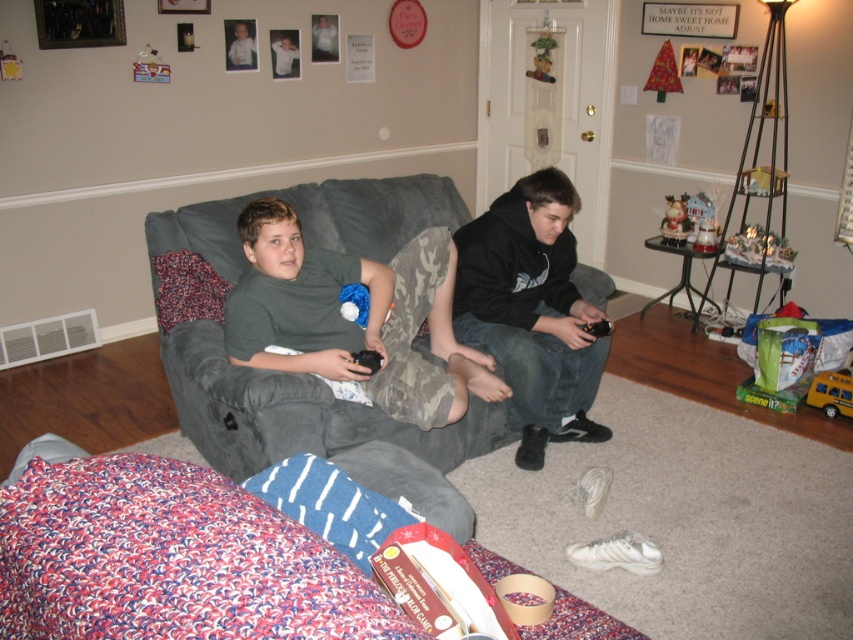
Does point (463, 396) come farther from viewer compared to point (494, 204)?

That is False.

Which is behind, point (273, 268) or point (489, 244)?

Point (489, 244)

Measure the distance between point (422, 307) and camera.

Point (422, 307) is 9.12 feet away from camera.

The image size is (853, 640). I want to click on green cotton shirt at center, so click(352, 321).

Measure the distance between gray fabric couch at center and black matte hoodie at center.

gray fabric couch at center and black matte hoodie at center are 41.08 centimeters apart from each other.

Does point (376, 216) come closer to viewer compared to point (537, 403)?

No.

Is point (282, 397) positioned in front of point (495, 256)?

Yes, it is in front of point (495, 256).

In order to click on gray fabric couch at center in this screenshot , I will do `click(300, 372)`.

Is gray fabric couch at center thinner than light blue shirt at center?

No, gray fabric couch at center is not thinner than light blue shirt at center.

Find the location of a particular element. The height and width of the screenshot is (640, 853). gray fabric couch at center is located at coordinates (300, 372).

Which is behind, point (467, 432) or point (241, 35)?

The point (241, 35) is more distant.

You are a GUI agent. You are given a task and a screenshot of the screen. Output one action in this format:
    pyautogui.click(x=<x>, y=<y>)
    Task: Click on the gray fabric couch at center
    
    Given the screenshot: What is the action you would take?
    [x=300, y=372]